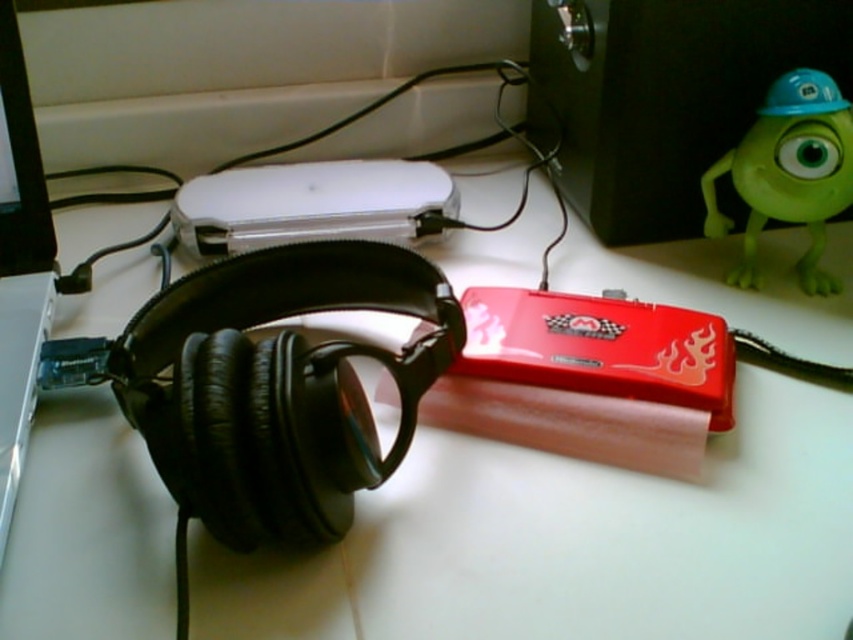
Question: Which object appears closest to the camera in this image?

Choices:
 (A) white glossy ipod at center
 (B) green rubber toy at upper right

Answer: (B)

Question: Can you confirm if white glossy ipod at center is thinner than green rubber toy at upper right?

Choices:
 (A) no
 (B) yes

Answer: (A)

Question: Can you confirm if white glossy ipod at center is positioned to the left of green rubber toy at upper right?

Choices:
 (A) yes
 (B) no

Answer: (A)

Question: Is white glossy ipod at center above green rubber toy at upper right?

Choices:
 (A) yes
 (B) no

Answer: (A)